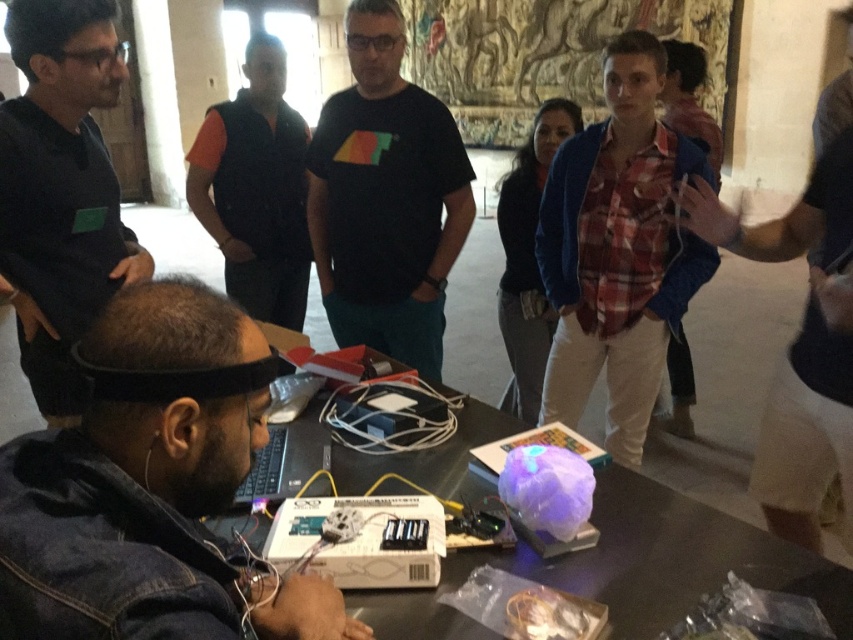
Question: Is denim jacket at lower left to the right of black matte t-shirt at center from the viewer's perspective?

Choices:
 (A) yes
 (B) no

Answer: (B)

Question: Is denim jacket at lower left positioned at the back of black matte shirt at upper left?

Choices:
 (A) no
 (B) yes

Answer: (A)

Question: Is metallic table at center thinner than black matte shirt at upper left?

Choices:
 (A) yes
 (B) no

Answer: (B)

Question: Which object is farther from the camera taking this photo?

Choices:
 (A) black matte shirt at upper left
 (B) metallic table at center

Answer: (A)

Question: Which of these objects is positioned closest to the metallic table at center?

Choices:
 (A) denim jacket at lower left
 (B) black matte shirt at upper left
 (C) black matte t-shirt at center

Answer: (A)

Question: Estimate the real-world distances between objects in this image. Which object is closer to the black matte shirt at upper left?

Choices:
 (A) denim jacket at lower left
 (B) black matte t-shirt at center

Answer: (B)